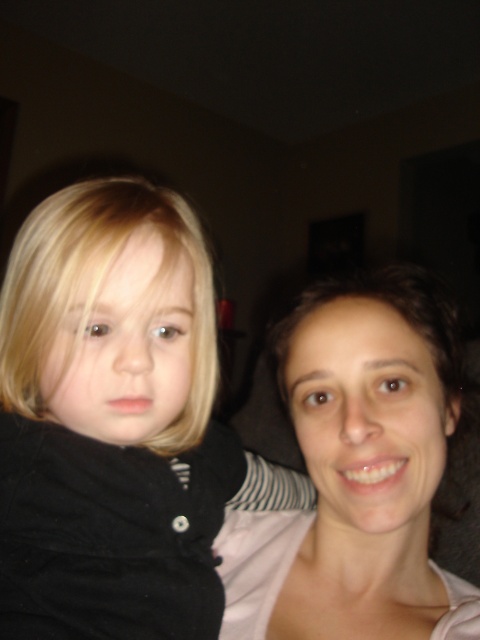
Question: Does black cotton shirt at left have a larger size compared to smooth skin face at center?

Choices:
 (A) no
 (B) yes

Answer: (B)

Question: Does black cotton shirt at left lie behind smooth skin face at center?

Choices:
 (A) no
 (B) yes

Answer: (A)

Question: Is the position of black cotton shirt at left more distant than that of smooth skin face at center?

Choices:
 (A) no
 (B) yes

Answer: (A)

Question: Which of the following is the farthest from the observer?

Choices:
 (A) (257, 568)
 (B) (33, 556)

Answer: (A)

Question: Which point is closer to the camera taking this photo?

Choices:
 (A) (354, 396)
 (B) (39, 419)

Answer: (A)